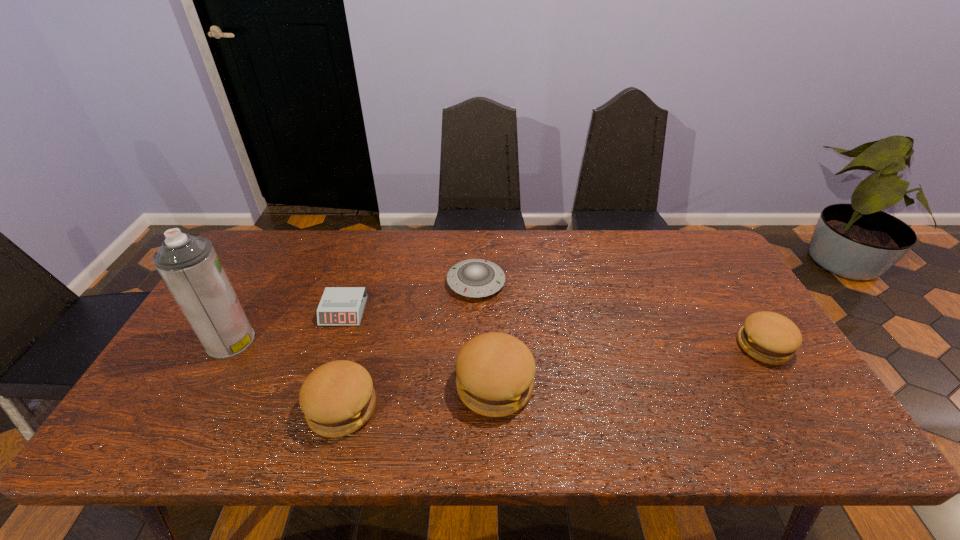
Where is `vacant space located on the left of the second hamburger from left to right`? The width and height of the screenshot is (960, 540). vacant space located on the left of the second hamburger from left to right is located at coordinates (387, 386).

Locate an element on the screen. The image size is (960, 540). vacant position located 0.090m on the back of the fourth tallest object is located at coordinates (737, 305).

This screenshot has width=960, height=540. Identify the location of free space located on the back of the tallest object. (275, 261).

Find the location of a particular element. The height and width of the screenshot is (540, 960). free space located on the left of the saucer is located at coordinates [367, 282].

The width and height of the screenshot is (960, 540). Find the location of `blank space located 0.060m on the left of the alarm clock`. blank space located 0.060m on the left of the alarm clock is located at coordinates (303, 311).

Locate an element on the screen. This screenshot has height=540, width=960. object that is at the far edge is located at coordinates (475, 278).

Find the location of `object located at the left edge`. object located at the left edge is located at coordinates (189, 265).

Identify the location of object at the right edge. (769, 337).

Locate an element on the screen. This screenshot has height=540, width=960. blank space at the far edge of the desktop is located at coordinates (565, 247).

Find the location of a particular element. The image size is (960, 540). vacant area at the near edge is located at coordinates (396, 396).